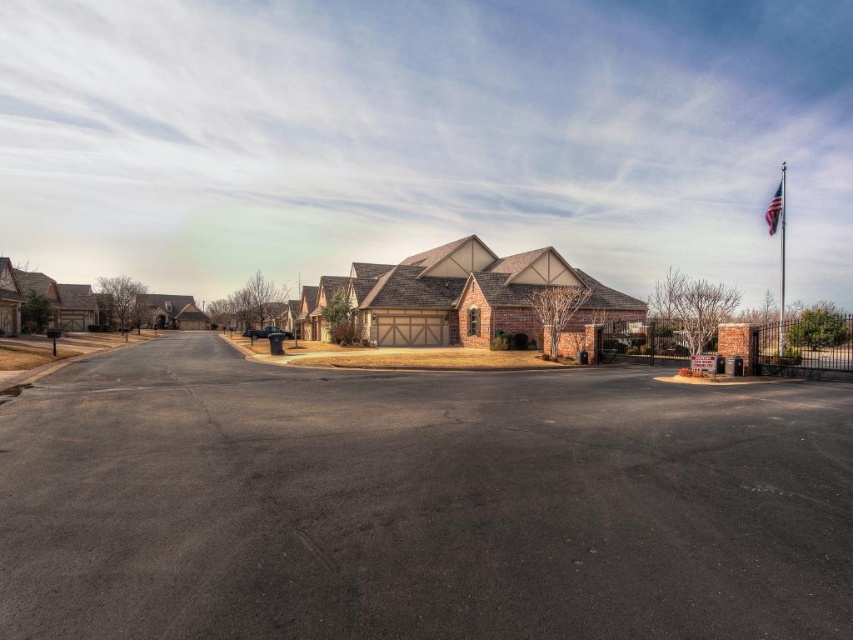
Question: Does metallic silver flag pole at right appear on the left side of american flag at upper right?

Choices:
 (A) yes
 (B) no

Answer: (A)

Question: Estimate the real-world distances between objects in this image. Which object is farther from the dark asphalt parking lot at center?

Choices:
 (A) metallic silver flag pole at right
 (B) american flag at upper right

Answer: (B)

Question: Which object is the closest to the dark asphalt parking lot at center?

Choices:
 (A) american flag at upper right
 (B) metallic silver flag pole at right

Answer: (B)

Question: Is the position of dark asphalt parking lot at center less distant than that of metallic silver flag pole at right?

Choices:
 (A) yes
 (B) no

Answer: (A)

Question: Which of the following is the farthest from the observer?

Choices:
 (A) american flag at upper right
 (B) metallic silver flag pole at right
 (C) dark asphalt parking lot at center

Answer: (A)

Question: Is metallic silver flag pole at right below american flag at upper right?

Choices:
 (A) no
 (B) yes

Answer: (B)